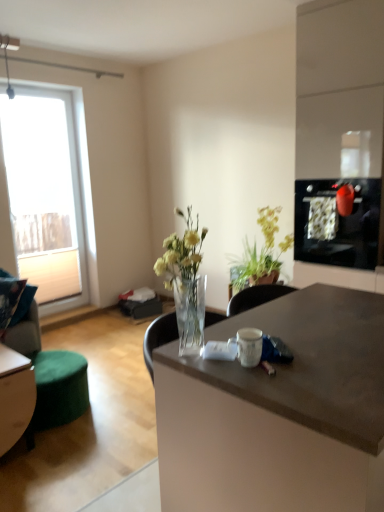
The width and height of the screenshot is (384, 512). Find the location of `vacant space in front of green fabric swivel chair at lower left`. vacant space in front of green fabric swivel chair at lower left is located at coordinates (61, 454).